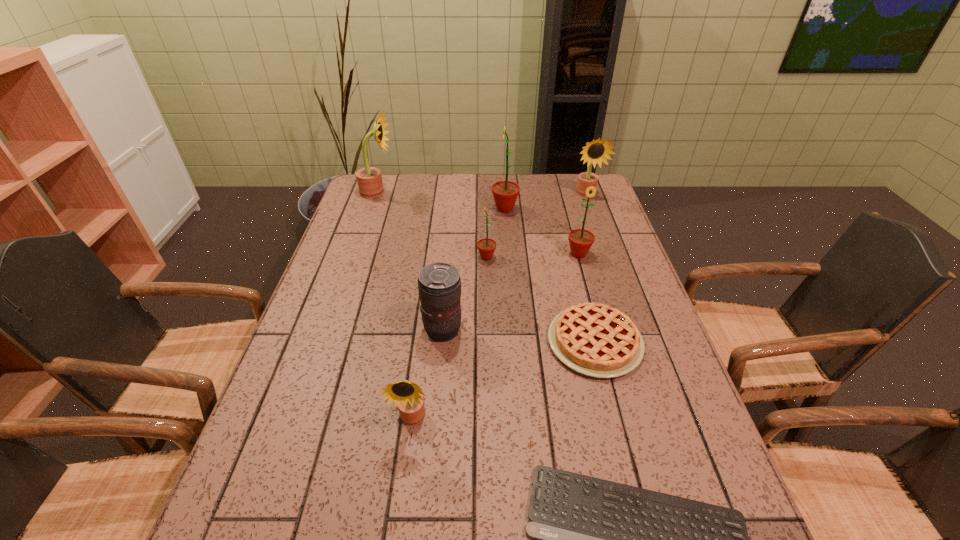
Image resolution: width=960 pixels, height=540 pixels. Find the location of `the leftmost sunflower`. the leftmost sunflower is located at coordinates (369, 179).

I want to click on the biggest yellow sunflower, so click(x=369, y=179).

Find the location of a particular element. The image size is (960, 540). the farthest green sunflower is located at coordinates (505, 193).

Identify the location of the rightmost green sunflower. (580, 240).

Where is `the second biggest yellow sunflower`? Image resolution: width=960 pixels, height=540 pixels. the second biggest yellow sunflower is located at coordinates (597, 151).

Identify the location of telephoto lens. The height and width of the screenshot is (540, 960). [x=439, y=284].

Find the location of `the smallest green sunflower`. the smallest green sunflower is located at coordinates (486, 246).

The width and height of the screenshot is (960, 540). Find the location of `the second nearest object`. the second nearest object is located at coordinates (407, 395).

Locate an element on the screen. Image resolution: width=960 pixels, height=540 pixels. the second yellow sunflower from left to right is located at coordinates (407, 395).

This screenshot has height=540, width=960. I want to click on pie, so click(597, 340).